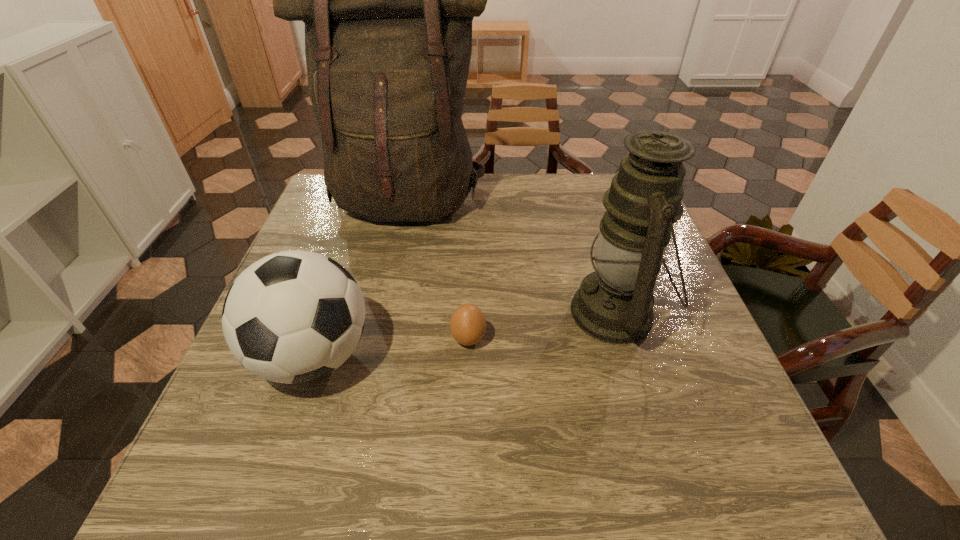
Locate an element on the screen. object present at the far edge is located at coordinates (388, 0).

Locate an element on the screen. Image resolution: width=960 pixels, height=540 pixels. backpack present at the left edge is located at coordinates (388, 0).

Identify the location of soccer ball located in the left edge section of the desktop. (295, 316).

You are a GUI agent. You are given a task and a screenshot of the screen. Output one action in this format:
    pyautogui.click(x=<x>, y=<y>)
    Task: Click on the object that is at the right edge
    
    Given the screenshot: What is the action you would take?
    pyautogui.click(x=614, y=304)

In order to click on object that is at the far left corner in this screenshot , I will do `click(388, 0)`.

In the image, there is a desktop. At what (x,y) coordinates should I click in order to perform the action: click on vacant region at the far edge. Please return your answer as a coordinate pair (x, y). The width and height of the screenshot is (960, 540). Looking at the image, I should click on (510, 186).

Where is `free space at the left edge`? free space at the left edge is located at coordinates (354, 254).

In the image, there is a desktop. Where is `vacant space at the near left corner`? Image resolution: width=960 pixels, height=540 pixels. vacant space at the near left corner is located at coordinates (277, 482).

The height and width of the screenshot is (540, 960). Find the location of `free space at the far right corner of the desktop`. free space at the far right corner of the desktop is located at coordinates (589, 188).

At what (x,y) coordinates should I click in order to perform the action: click on free space at the near right corner of the desktop. Please return your answer as a coordinate pair (x, y). Looking at the image, I should click on click(x=781, y=500).